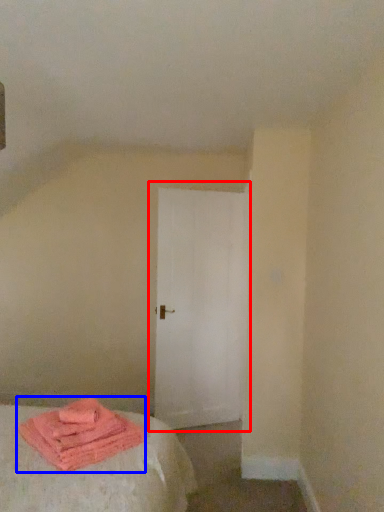
Question: Which object appears closest to the camera in this image, door (highlighted by a red box) or material (highlighted by a blue box)?

Choices:
 (A) door
 (B) material

Answer: (B)